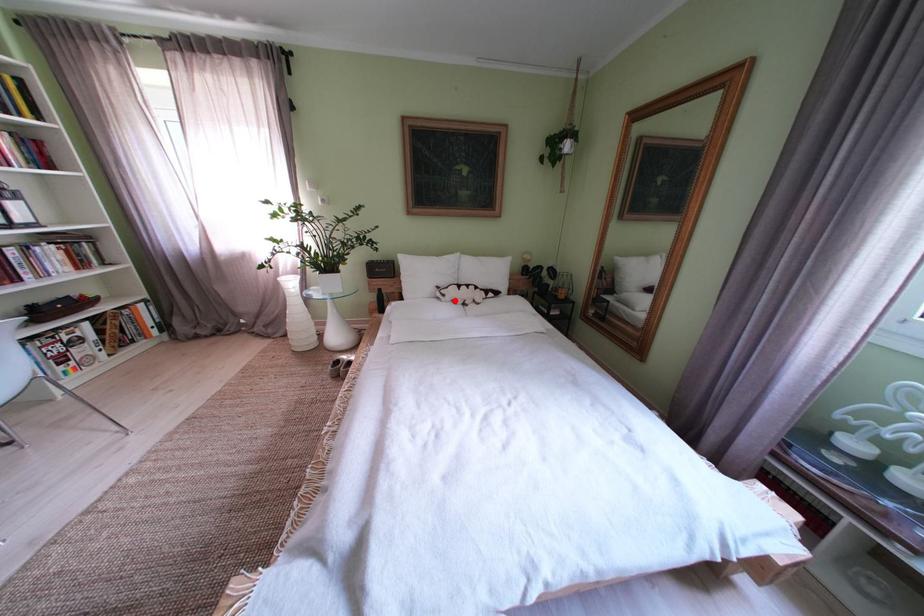
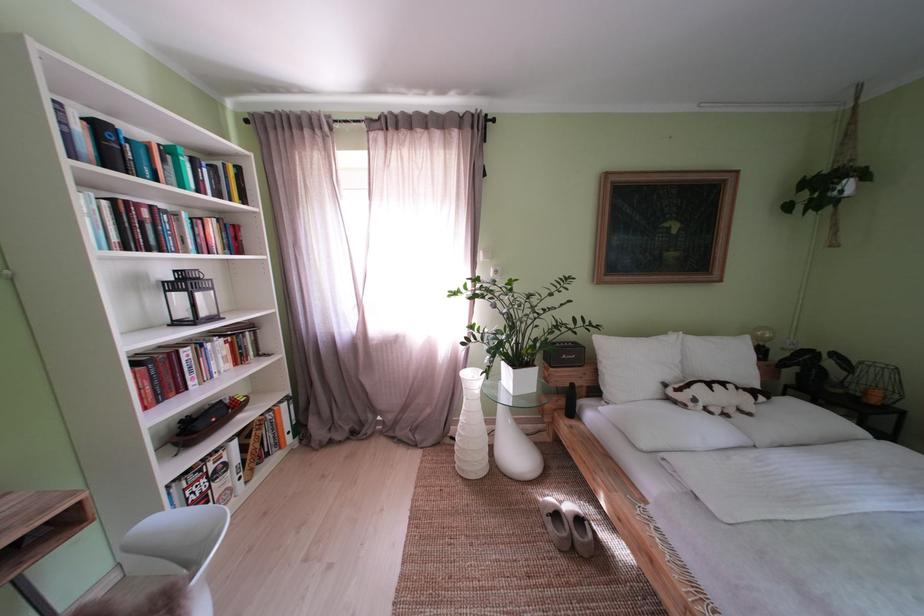
Question: I am providing you with two images of the same scene from different viewpoints. Given a red point in image1, look at the same physical point in image2. Is it:

Choices:
 (A) Closer to the viewpoint
 (B) Farther from the viewpoint

Answer: (B)